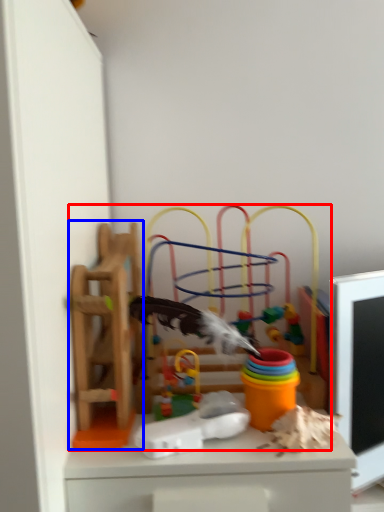
Question: Which point is closer to the camera, toy (highlighted by a red box) or toy (highlighted by a blue box)?

Choices:
 (A) toy
 (B) toy

Answer: (B)